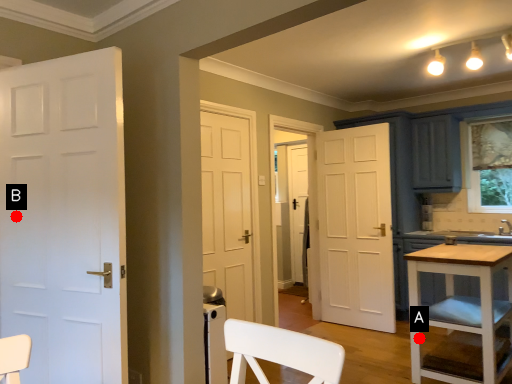
Question: Two points are circled on the image, labeled by A and B beside each circle. Which point is further to the camera?

Choices:
 (A) A is further
 (B) B is further

Answer: (A)